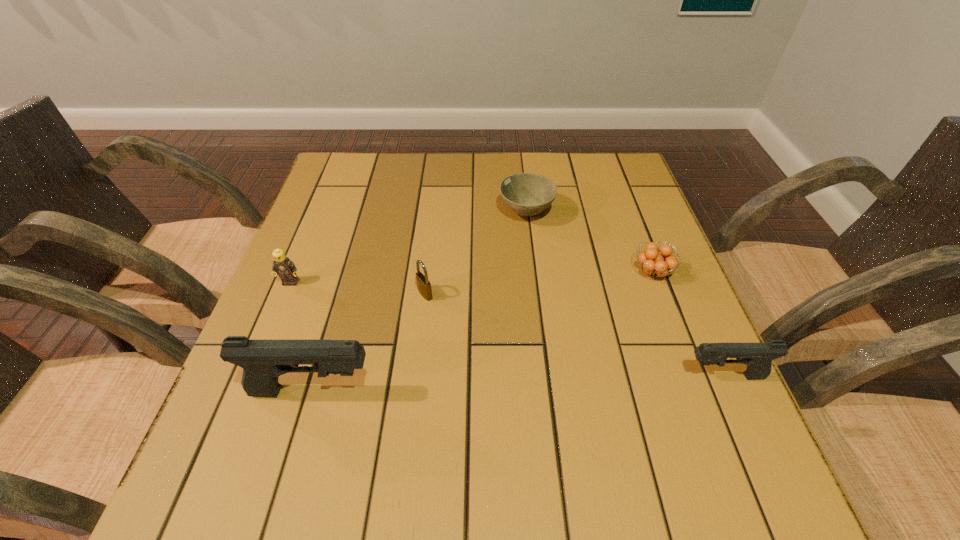
Point out which object is positioned as the second nearest to the farther pistol. Please provide its 2D coordinates. Your answer should be formatted as a tuple, i.e. [(x, y)], where the tuple contains the x and y coordinates of a point satisfying the conditions above.

[(527, 194)]

Identify which object is the fourth closest to the orange fruit. Please provide its 2D coordinates. Your answer should be formatted as a tuple, i.e. [(x, y)], where the tuple contains the x and y coordinates of a point satisfying the conditions above.

[(263, 361)]

Locate an element on the screen. The width and height of the screenshot is (960, 540). vacant space that satisfies the following two spatial constraints: 1. in front of the Lego; 2. on the left side of the fourth object from right to left is located at coordinates (286, 294).